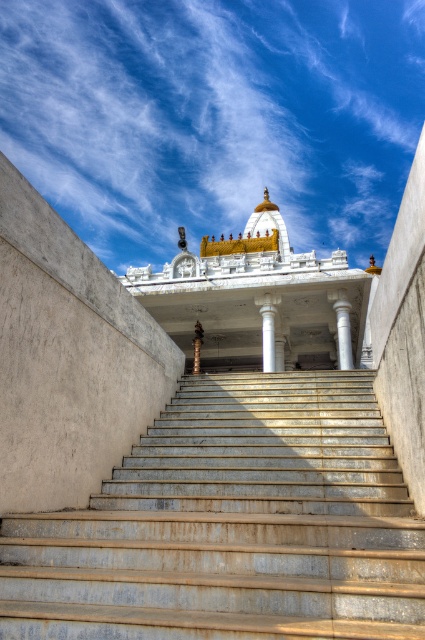
Question: Does white marble temple at center have a lesser width compared to white marble pillar at center?

Choices:
 (A) no
 (B) yes

Answer: (A)

Question: Does rusty metal stairs at center have a smaller size compared to white marble column at center?

Choices:
 (A) yes
 (B) no

Answer: (B)

Question: Can you confirm if rusty metal stairs at center is positioned to the left of white marble temple at center?

Choices:
 (A) no
 (B) yes

Answer: (B)

Question: Among these objects, which one is nearest to the camera?

Choices:
 (A) white marble column at center
 (B) rusty metal stairs at center
 (C) white marble temple at center

Answer: (B)

Question: Which point is closer to the camera taking this photo?

Choices:
 (A) (280, 298)
 (B) (56, 540)

Answer: (B)

Question: Among these objects, which one is farthest from the camera?

Choices:
 (A) white marble column at center
 (B) white marble pillar at center
 (C) white marble temple at center
 (D) rusty metal stairs at center

Answer: (B)